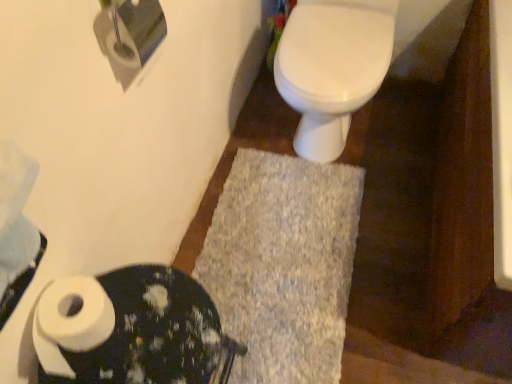
Locate an element on the screen. white glossy toilet at center is located at coordinates (332, 67).

Describe the element at coordinates (283, 265) in the screenshot. I see `gray shaggy bath mat at center` at that location.

The width and height of the screenshot is (512, 384). Identify the location of white matte toilet paper at lower left, acting as the 1th toilet paper starting from the bottom. (70, 322).

This screenshot has height=384, width=512. What do you see at coordinates (132, 330) in the screenshot? I see `white matte toilet paper at lower left` at bounding box center [132, 330].

Image resolution: width=512 pixels, height=384 pixels. I want to click on white glossy toilet at center, so click(332, 67).

Which object is positioned more to the left, gray shaggy bath mat at center or white matte toilet paper at upper left, which is counted as the 2th toilet paper, starting from the bottom?

Positioned to the left is white matte toilet paper at upper left, which is counted as the 2th toilet paper, starting from the bottom.

From a real-world perspective, which is physically above, gray shaggy bath mat at center or white matte toilet paper at upper left, the 1th toilet paper positioned from the top?

From a 3D spatial view, white matte toilet paper at upper left, the 1th toilet paper positioned from the top, is above.

Measure the distance from gray shaggy bath mat at center to white matte toilet paper at upper left, which is counted as the 2th toilet paper, starting from the bottom.

gray shaggy bath mat at center and white matte toilet paper at upper left, which is counted as the 2th toilet paper, starting from the bottom, are 29.87 inches apart.

Which is farther from the camera, (238, 218) or (149, 46)?

The point (238, 218) is behind.

Is white matte toilet paper at upper left, the 1th toilet paper positioned from the top, completely or partially inside white matte toilet paper at lower left?

Actually, white matte toilet paper at upper left, the 1th toilet paper positioned from the top, is outside white matte toilet paper at lower left.

From a real-world perspective, who is located lower, white matte toilet paper at lower left or white matte toilet paper at upper left, the 1th toilet paper positioned from the top?

white matte toilet paper at lower left, from a real-world perspective.

Based on their sizes in the image, would you say white matte toilet paper at lower left is bigger or smaller than white matte toilet paper at upper left, the 1th toilet paper positioned from the top?

Clearly, white matte toilet paper at lower left is larger in size than white matte toilet paper at upper left, the 1th toilet paper positioned from the top.

Is the position of white matte toilet paper at lower left more distant than that of white matte toilet paper at upper left, which is counted as the 2th toilet paper, starting from the bottom?

Yes, the depth of white matte toilet paper at lower left is greater than that of white matte toilet paper at upper left, which is counted as the 2th toilet paper, starting from the bottom.

Does white glossy toilet at center turn towards white matte toilet paper at lower left, which is the 2th toilet paper from top to bottom?

Yes.

Identify the location of bidet below the white matte toilet paper at lower left, acting as the 1th toilet paper starting from the bottom (from a real-world perspective). The image size is (512, 384). (332, 67).

What's the angular difference between white glossy toilet at center and white matte toilet paper at lower left, which is the 2th toilet paper from top to bottom,'s facing directions?

88.7 degrees separate the facing orientations of white glossy toilet at center and white matte toilet paper at lower left, which is the 2th toilet paper from top to bottom.

Which object is further away from the camera taking this photo, white glossy toilet at center or white matte toilet paper at lower left, which is the 2th toilet paper from top to bottom?

Positioned behind is white glossy toilet at center.

Is white matte toilet paper at lower left, acting as the 1th toilet paper starting from the bottom, a part of white matte toilet paper at lower left?

Definitely not — white matte toilet paper at lower left, acting as the 1th toilet paper starting from the bottom, is not inside white matte toilet paper at lower left.

Is point (47, 378) closer or farther from the camera than point (72, 292)?

Point (47, 378) is farther from the camera than point (72, 292).

Between white matte toilet paper at lower left and white matte toilet paper at lower left, acting as the 1th toilet paper starting from the bottom, which one has larger width?

white matte toilet paper at lower left is wider.

How many degrees apart are the facing directions of white matte toilet paper at lower left and gray shaggy bath mat at center?

There is a 87.9-degree angle between the facing directions of white matte toilet paper at lower left and gray shaggy bath mat at center.

From the image's perspective, is white matte toilet paper at lower left above gray shaggy bath mat at center?

No.

From a real-world perspective, which object stands above the other?

In real-world perspective, white matte toilet paper at lower left is above.

Can you confirm if white matte toilet paper at lower left is taller than gray shaggy bath mat at center?

Yes.

Could you tell me if gray shaggy bath mat at center is turned towards white matte toilet paper at lower left, which is the 2th toilet paper from top to bottom?

No, gray shaggy bath mat at center is not turned towards white matte toilet paper at lower left, which is the 2th toilet paper from top to bottom.

Is gray shaggy bath mat at center shorter than white matte toilet paper at lower left, which is the 2th toilet paper from top to bottom?

Correct, gray shaggy bath mat at center is not as tall as white matte toilet paper at lower left, which is the 2th toilet paper from top to bottom.

Can you tell me how much gray shaggy bath mat at center and white matte toilet paper at lower left, which is the 2th toilet paper from top to bottom, differ in facing direction?

gray shaggy bath mat at center and white matte toilet paper at lower left, which is the 2th toilet paper from top to bottom, are facing 86.8 degrees away from each other.

From the image's perspective, is white matte toilet paper at upper left, the 1th toilet paper positioned from the top, beneath gray shaggy bath mat at center?

No, from the image's perspective, white matte toilet paper at upper left, the 1th toilet paper positioned from the top, is not beneath gray shaggy bath mat at center.

Is white matte toilet paper at upper left, the 1th toilet paper positioned from the top, oriented away from gray shaggy bath mat at center?

No, gray shaggy bath mat at center is not at the back of white matte toilet paper at upper left, the 1th toilet paper positioned from the top.

Considering the relative sizes of white matte toilet paper at upper left, which is counted as the 2th toilet paper, starting from the bottom, and gray shaggy bath mat at center in the image provided, is white matte toilet paper at upper left, which is counted as the 2th toilet paper, starting from the bottom, wider than gray shaggy bath mat at center?

In fact, white matte toilet paper at upper left, which is counted as the 2th toilet paper, starting from the bottom, might be narrower than gray shaggy bath mat at center.

How far apart are white matte toilet paper at upper left, which is counted as the 2th toilet paper, starting from the bottom, and gray shaggy bath mat at center?

white matte toilet paper at upper left, which is counted as the 2th toilet paper, starting from the bottom, and gray shaggy bath mat at center are 29.87 inches apart.

Find the location of a particular element. toilet paper above the gray shaggy bath mat at center (from the image's perspective) is located at coordinates (129, 34).

Find the location of `porcelain lying behind the white matte toilet paper at upper left, the 1th toilet paper positioned from the top`. porcelain lying behind the white matte toilet paper at upper left, the 1th toilet paper positioned from the top is located at coordinates (132, 330).

Consider the image. Based on their spatial positions, is white matte toilet paper at lower left or white glossy toilet at center further from white matte toilet paper at lower left, acting as the 1th toilet paper starting from the bottom?

Among the two, white glossy toilet at center is located further to white matte toilet paper at lower left, acting as the 1th toilet paper starting from the bottom.

Considering their positions, is white matte toilet paper at upper left, the 1th toilet paper positioned from the top, positioned closer to white glossy toilet at center than white matte toilet paper at lower left?

The object closer to white glossy toilet at center is white matte toilet paper at upper left, the 1th toilet paper positioned from the top.

Consider the image. From the image, which object appears to be farther from white matte toilet paper at upper left, the 1th toilet paper positioned from the top, white matte toilet paper at lower left or white glossy toilet at center?

→ Based on the image, white glossy toilet at center appears to be further to white matte toilet paper at upper left, the 1th toilet paper positioned from the top.

Considering their positions, is white matte toilet paper at lower left positioned closer to white glossy toilet at center than white matte toilet paper at lower left, acting as the 1th toilet paper starting from the bottom?

Based on the image, white matte toilet paper at lower left appears to be nearer to white glossy toilet at center.

Which object lies nearer to the anchor point white matte toilet paper at lower left, which is the 2th toilet paper from top to bottom, white matte toilet paper at lower left or white matte toilet paper at upper left, which is counted as the 2th toilet paper, starting from the bottom?

white matte toilet paper at lower left is positioned closer to the anchor white matte toilet paper at lower left, which is the 2th toilet paper from top to bottom.

Based on their spatial positions, is white glossy toilet at center or white matte toilet paper at lower left, which is the 2th toilet paper from top to bottom, closer to gray shaggy bath mat at center?

white glossy toilet at center lies closer to gray shaggy bath mat at center than the other object.

Looking at the image, which one is located closer to gray shaggy bath mat at center, white matte toilet paper at upper left, which is counted as the 2th toilet paper, starting from the bottom, or white matte toilet paper at lower left?

white matte toilet paper at lower left is positioned closer to the anchor gray shaggy bath mat at center.

Estimate the real-world distances between objects in this image. Which object is further from white matte toilet paper at lower left, white glossy toilet at center or white matte toilet paper at lower left, acting as the 1th toilet paper starting from the bottom?

Based on the image, white glossy toilet at center appears to be further to white matte toilet paper at lower left.

Where is `toilet paper between white glossy toilet at center and white matte toilet paper at lower left, acting as the 1th toilet paper starting from the bottom, in the vertical direction`? toilet paper between white glossy toilet at center and white matte toilet paper at lower left, acting as the 1th toilet paper starting from the bottom, in the vertical direction is located at coordinates (129, 34).

Image resolution: width=512 pixels, height=384 pixels. In order to click on porcelain between white matte toilet paper at lower left, acting as the 1th toilet paper starting from the bottom, and gray shaggy bath mat at center, along the z-axis in this screenshot , I will do `click(132, 330)`.

The image size is (512, 384). Identify the location of toilet paper between white matte toilet paper at upper left, the 1th toilet paper positioned from the top, and white matte toilet paper at lower left vertically. (70, 322).

Where is `bath mat between white matte toilet paper at upper left, the 1th toilet paper positioned from the top, and white matte toilet paper at lower left, which is the 2th toilet paper from top to bottom, vertically`? This screenshot has height=384, width=512. bath mat between white matte toilet paper at upper left, the 1th toilet paper positioned from the top, and white matte toilet paper at lower left, which is the 2th toilet paper from top to bottom, vertically is located at coordinates (283, 265).